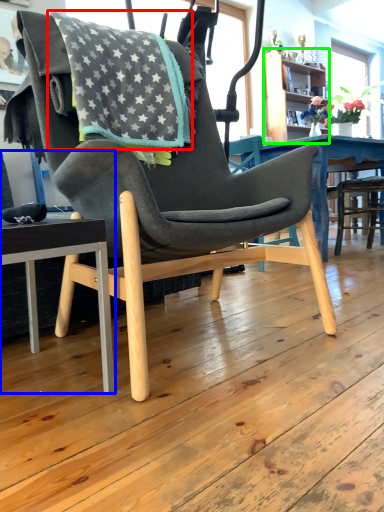
Question: Considering the real-world distances, which object is farthest from blanket (highlighted by a red box)? chair (highlighted by a blue box) or bookshelf (highlighted by a green box)?

Choices:
 (A) chair
 (B) bookshelf

Answer: (B)